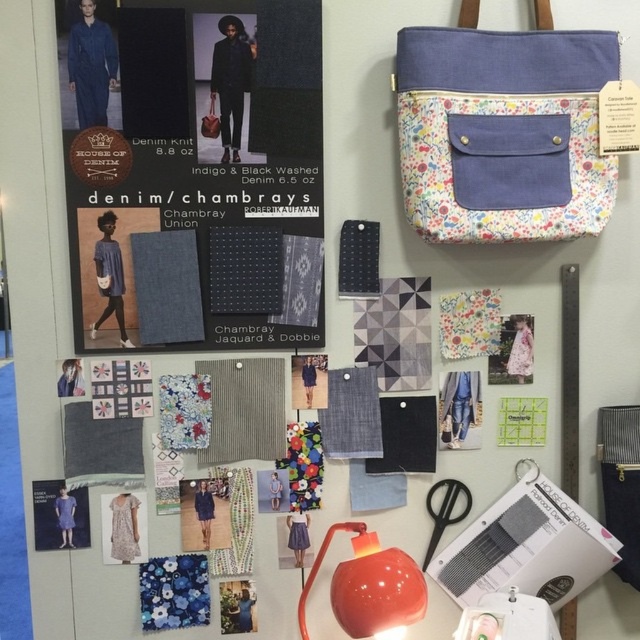
Between denim knit at upper left and black plastic scissors at lower center, which one is positioned lower?

Positioned lower is black plastic scissors at lower center.

Can you confirm if denim knit at upper left is bigger than black plastic scissors at lower center?

Yes, denim knit at upper left is bigger than black plastic scissors at lower center.

The height and width of the screenshot is (640, 640). What are the coordinates of `denim knit at upper left` in the screenshot? It's located at (193, 173).

Can you confirm if floral canvas tote at upper right is taller than leather-like textured bag at upper center?

Indeed, floral canvas tote at upper right has a greater height compared to leather-like textured bag at upper center.

Does floral canvas tote at upper right have a greater width compared to leather-like textured bag at upper center?

Correct, the width of floral canvas tote at upper right exceeds that of leather-like textured bag at upper center.

Where is `floral canvas tote at upper right`? floral canvas tote at upper right is located at coordinates (502, 118).

Where is `floral canvas tote at upper right`? Image resolution: width=640 pixels, height=640 pixels. floral canvas tote at upper right is located at coordinates (502, 118).

From the picture: Does floral canvas tote at upper right have a lesser width compared to black plastic scissors at lower center?

In fact, floral canvas tote at upper right might be wider than black plastic scissors at lower center.

Is floral canvas tote at upper right positioned at the back of black plastic scissors at lower center?

No, floral canvas tote at upper right is in front of black plastic scissors at lower center.

Is point (488, 237) positioned behind point (429, 557)?

No, it is not.

This screenshot has width=640, height=640. I want to click on floral canvas tote at upper right, so click(x=502, y=118).